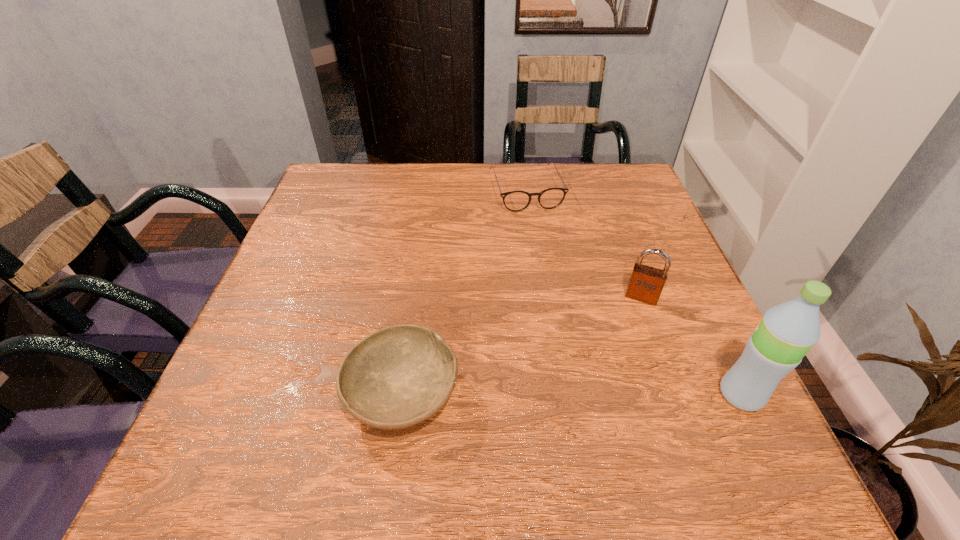
Find the location of a particular element. vacant space located on the front-facing side of the second object from right to left is located at coordinates (629, 340).

The width and height of the screenshot is (960, 540). What are the coordinates of `free point located on the front-facing side of the second object from right to left` in the screenshot? It's located at (612, 409).

Image resolution: width=960 pixels, height=540 pixels. Identify the location of vacant area located on the front-facing side of the second object from right to left. (622, 368).

I want to click on vacant space positioned 0.050m through the lenses of the farthest object, so click(x=539, y=224).

Image resolution: width=960 pixels, height=540 pixels. I want to click on free space located through the lenses of the farthest object, so click(x=555, y=266).

I want to click on vacant space located through the lenses of the farthest object, so click(569, 305).

Find the location of a particular element. This screenshot has width=960, height=540. object that is at the far edge is located at coordinates (515, 201).

Where is `bowl at the near edge`? bowl at the near edge is located at coordinates (x=397, y=377).

Find the location of a particular element. water bottle present at the near edge is located at coordinates (x=787, y=331).

You are a GUI agent. You are given a task and a screenshot of the screen. Output one action in this format:
    pyautogui.click(x=<x>, y=<y>)
    Task: Click on the water bottle that is at the right edge
    
    Given the screenshot: What is the action you would take?
    pyautogui.click(x=787, y=331)